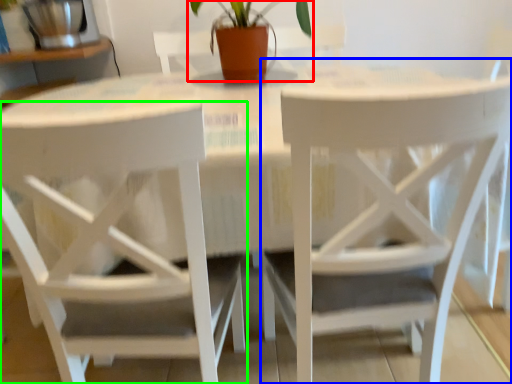
Question: Estimate the real-world distances between objects in this image. Which object is farther from houseplant (highlighted by a red box), chair (highlighted by a blue box) or chair (highlighted by a green box)?

Choices:
 (A) chair
 (B) chair

Answer: (B)